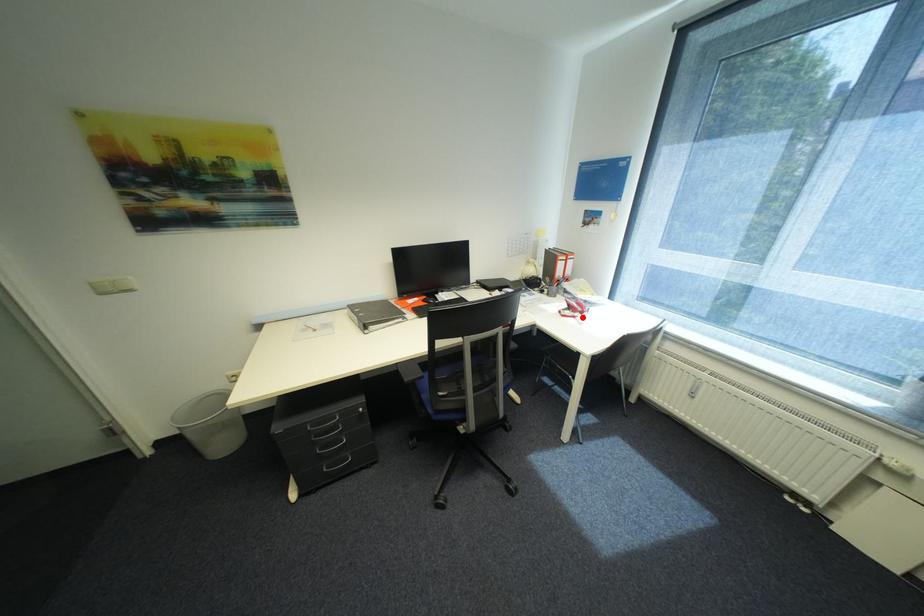
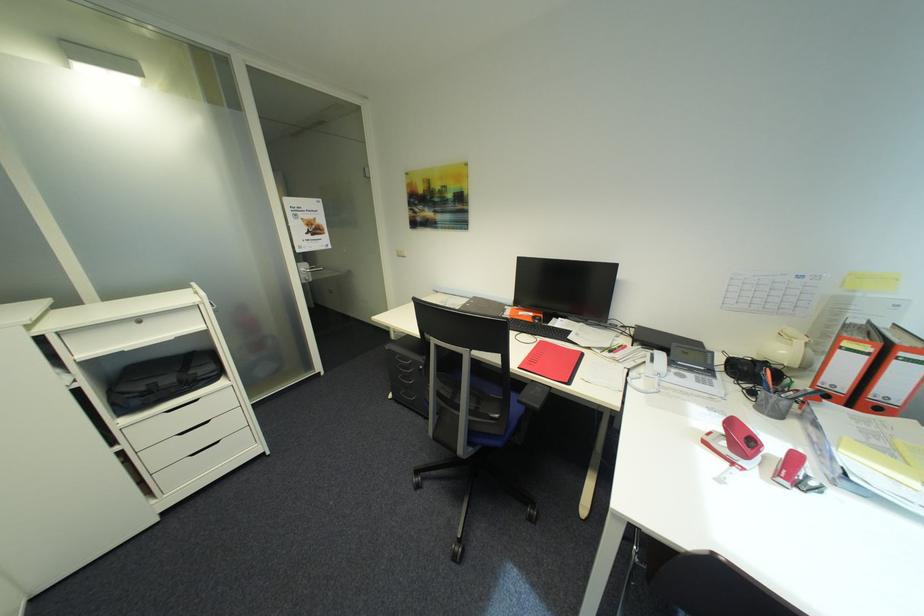
Find the pixel in the second image that matches the highlighted location in the first image.

(742, 464)